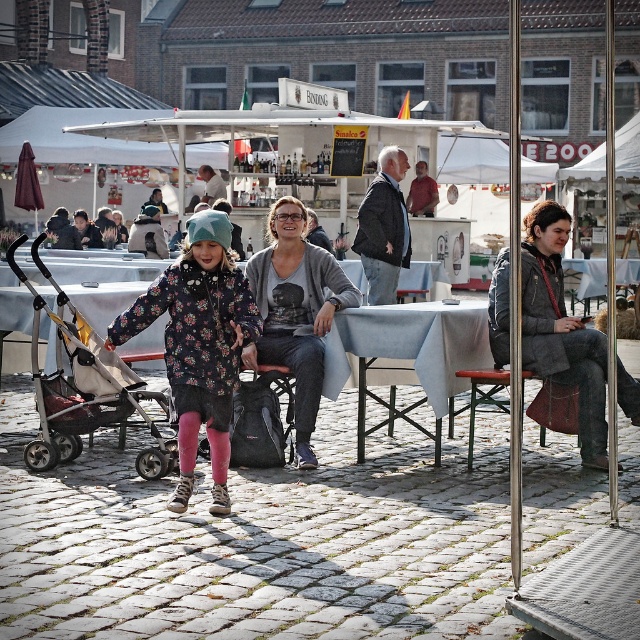
You are a tailor who needs to determine which clothing item is shorter in height between the gray woolen coat at center and the gray cardigan at center. Which one should you choose?

The gray woolen coat at center is not as tall as the gray cardigan at center, so you should choose the gray woolen coat at center.

You are a photographer standing at the cobblestone street in the foreground. You want to take a photo of the light blue fabric table at center and the gray cardigan at center. Based on their positions, which object should you focus on first to ensure both are in frame?

The light blue fabric table at center is below gray cardigan at center, so you should focus on the gray cardigan at center first to ensure both are in frame.